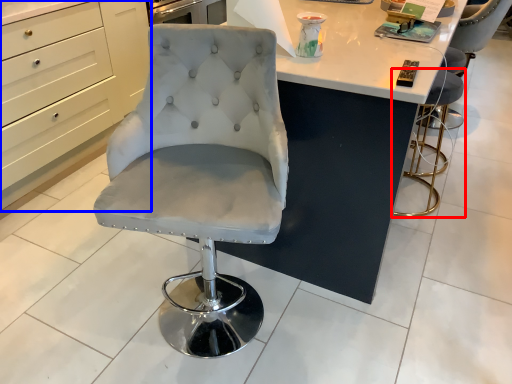
Question: Among these objects, which one is farthest to the camera, chair (highlighted by a red box) or cabinetry (highlighted by a blue box)?

Choices:
 (A) chair
 (B) cabinetry

Answer: (A)